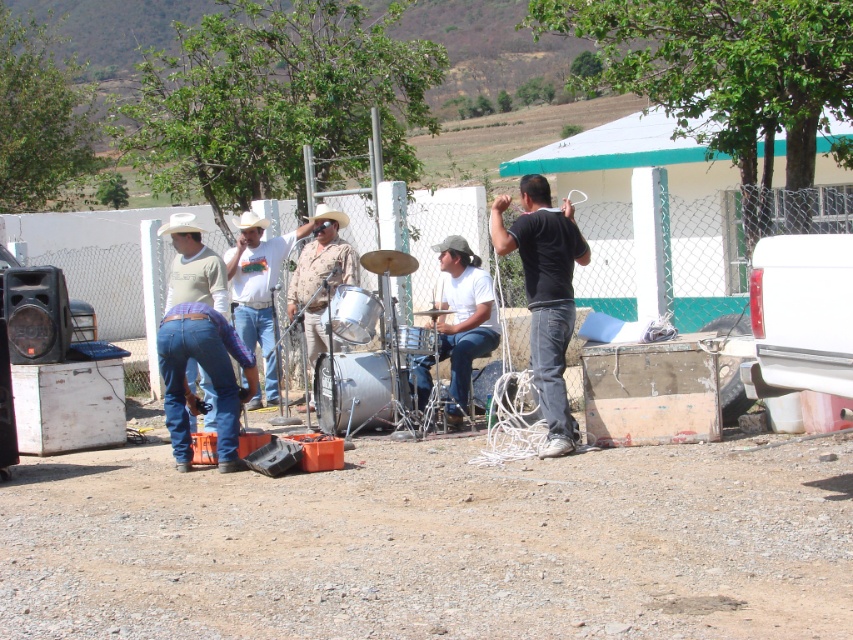
Measure the distance between black matte shirt at center and camera.

black matte shirt at center is 7.80 meters away from camera.

Is black matte shirt at center below white matte drum at center?

No, black matte shirt at center is not below white matte drum at center.

Locate an element on the screen. black matte shirt at center is located at coordinates (544, 292).

Where is `black matte shirt at center`? The image size is (853, 640). black matte shirt at center is located at coordinates tap(544, 292).

Is black matte shirt at center below camouflage shirt at center?

Yes.

Does black matte shirt at center have a greater height compared to camouflage shirt at center?

Correct, black matte shirt at center is much taller as camouflage shirt at center.

Is point (554, 212) closer to viewer compared to point (309, 278)?

Yes, point (554, 212) is in front of point (309, 278).

Image resolution: width=853 pixels, height=640 pixels. I want to click on black matte shirt at center, so click(544, 292).

Is white matte drum at center taller than camouflage shirt at center?

Yes, white matte drum at center is taller than camouflage shirt at center.

Between point (479, 317) and point (310, 298), which one is positioned behind?

The point (310, 298) is behind.

Find the location of `white matte drum at center`. white matte drum at center is located at coordinates (463, 317).